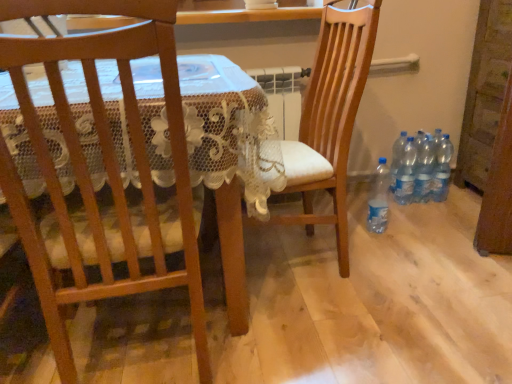
Find the location of a particular element. vacant region to the right of clear plastic bottles at lower right, the 5th bottle positioned from the left is located at coordinates [x=460, y=196].